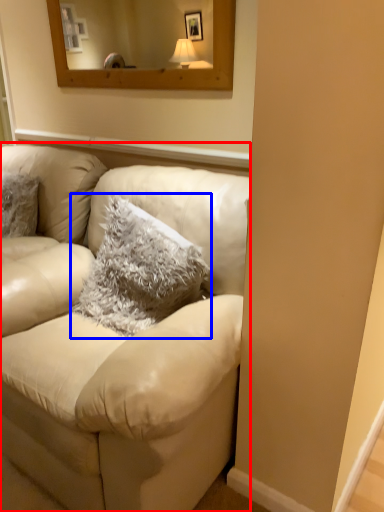
Question: Among these objects, which one is farthest to the camera, studio couch (highlighted by a red box) or pillow (highlighted by a blue box)?

Choices:
 (A) studio couch
 (B) pillow

Answer: (B)